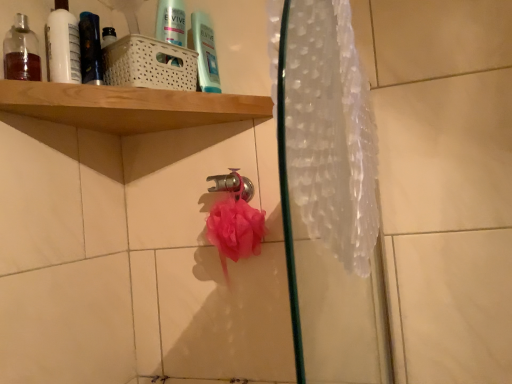
Question: Considering the relative sizes of shiny black bottle at upper left and wooden shelf at upper left in the image provided, is shiny black bottle at upper left taller than wooden shelf at upper left?

Choices:
 (A) yes
 (B) no

Answer: (A)

Question: Is shiny black bottle at upper left to the right of wooden shelf at upper left from the viewer's perspective?

Choices:
 (A) no
 (B) yes

Answer: (A)

Question: Can you see shiny black bottle at upper left touching wooden shelf at upper left?

Choices:
 (A) no
 (B) yes

Answer: (A)

Question: Does shiny black bottle at upper left have a lesser width compared to wooden shelf at upper left?

Choices:
 (A) yes
 (B) no

Answer: (A)

Question: Is shiny black bottle at upper left looking in the opposite direction of wooden shelf at upper left?

Choices:
 (A) no
 (B) yes

Answer: (A)

Question: Considering the positions of point (258, 240) and point (313, 84), is point (258, 240) closer or farther from the camera than point (313, 84)?

Choices:
 (A) farther
 (B) closer

Answer: (A)

Question: From a real-world perspective, relative to translucent plastic shower curtain at right, is pink mesh sponge at center vertically above or below?

Choices:
 (A) below
 (B) above

Answer: (A)

Question: From the image's perspective, relative to translucent plastic shower curtain at right, is pink mesh sponge at center above or below?

Choices:
 (A) above
 (B) below

Answer: (B)

Question: Is pink mesh sponge at center in front of or behind translucent plastic shower curtain at right in the image?

Choices:
 (A) front
 (B) behind

Answer: (B)

Question: Considering their positions, is pink mesh sponge at center located in front of or behind white glossy bottle at upper left, which is the 1th mouthwash from back to front?

Choices:
 (A) behind
 (B) front

Answer: (A)

Question: Is pink mesh sponge at center inside the boundaries of white glossy bottle at upper left, placed as the second mouthwash when sorted from front to back, or outside?

Choices:
 (A) inside
 (B) outside

Answer: (B)

Question: Considering the positions of point (240, 240) and point (49, 24), is point (240, 240) closer or farther from the camera than point (49, 24)?

Choices:
 (A) closer
 (B) farther

Answer: (B)

Question: From their relative heights in the image, would you say pink mesh sponge at center is taller or shorter than white glossy bottle at upper left, placed as the second mouthwash when sorted from front to back?

Choices:
 (A) short
 (B) tall

Answer: (A)

Question: Considering the positions of point (115, 102) and point (295, 102), is point (115, 102) closer or farther from the camera than point (295, 102)?

Choices:
 (A) closer
 (B) farther

Answer: (B)

Question: In terms of width, does wooden shelf at upper left look wider or thinner when compared to translucent plastic shower curtain at right?

Choices:
 (A) wide
 (B) thin

Answer: (A)